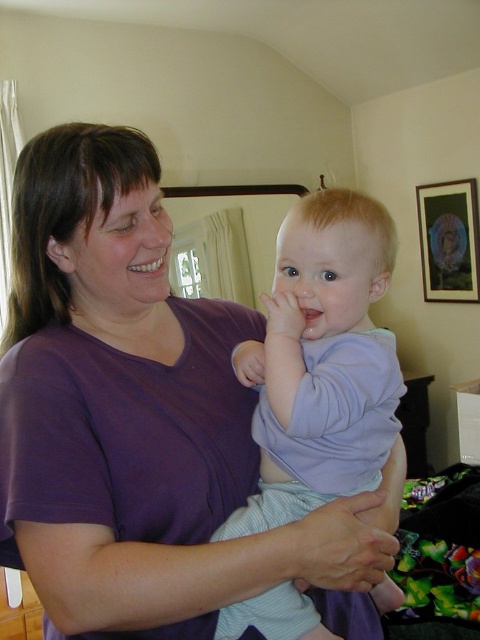
From the picture: Is light blue cotton baby at center in front of wooden frame at upper right?

Yes, light blue cotton baby at center is closer to the viewer.

Can you confirm if light blue cotton baby at center is shorter than wooden frame at upper right?

No.

You are a GUI agent. You are given a task and a screenshot of the screen. Output one action in this format:
    pyautogui.click(x=<x>, y=<y>)
    Task: Click on the light blue cotton baby at center
    The image size is (480, 640).
    Given the screenshot: What is the action you would take?
    (322, 362)

Which is in front, point (80, 552) or point (458, 221)?

Point (80, 552)

Can you confirm if purple cotton shirt at center is positioned to the left of wooden frame at upper right?

A: Correct, you'll find purple cotton shirt at center to the left of wooden frame at upper right.

Between point (95, 282) and point (474, 236), which one is positioned behind?

The point (474, 236) is behind.

What are the coordinates of `purple cotton shirt at center` in the screenshot? It's located at (144, 419).

Is purple cotton shirt at center wider than light blue cotton baby at center?

Yes.

Does point (49, 374) come in front of point (343, 380)?

Yes, point (49, 374) is in front of point (343, 380).

Is point (48, 609) positioned after point (311, 285)?

That is False.

The height and width of the screenshot is (640, 480). I want to click on purple cotton shirt at center, so click(x=144, y=419).